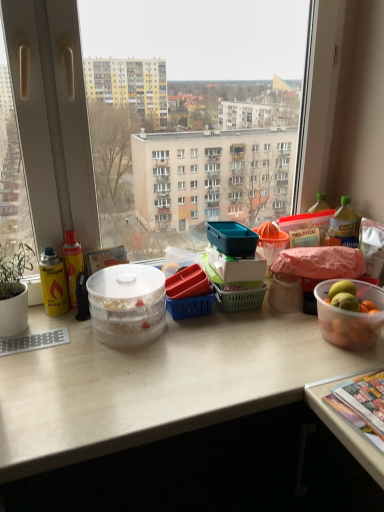
Identify the location of blank space to the left of translucent plastic bowl at right, which appears as the first bowl when viewed from the right. (280, 340).